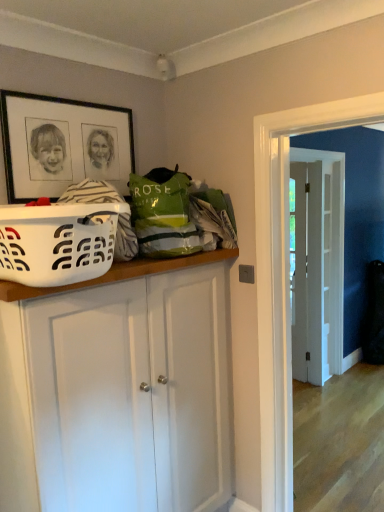
Question: Should I look upward or downward to see white plastic laundry basket at left?

Choices:
 (A) down
 (B) up

Answer: (B)

Question: Is white matte cabinet at center touching black matte picture frame at upper left?

Choices:
 (A) yes
 (B) no

Answer: (B)

Question: Considering the relative positions of white matte cabinet at center and black matte picture frame at upper left in the image provided, is white matte cabinet at center in front of black matte picture frame at upper left?

Choices:
 (A) yes
 (B) no

Answer: (A)

Question: Does white matte cabinet at center appear on the left side of black matte picture frame at upper left?

Choices:
 (A) no
 (B) yes

Answer: (A)

Question: Is white matte cabinet at center outside of black matte picture frame at upper left?

Choices:
 (A) no
 (B) yes

Answer: (B)

Question: Is white matte cabinet at center facing away from black matte picture frame at upper left?

Choices:
 (A) no
 (B) yes

Answer: (A)

Question: Does white matte cabinet at center turn towards black matte picture frame at upper left?

Choices:
 (A) yes
 (B) no

Answer: (B)

Question: Considering the relative sizes of white matte cabinet at center and white wooden door at center in the image provided, is white matte cabinet at center wider than white wooden door at center?

Choices:
 (A) no
 (B) yes

Answer: (A)

Question: Can you confirm if white matte cabinet at center is thinner than white wooden door at center?

Choices:
 (A) no
 (B) yes

Answer: (B)

Question: Is white matte cabinet at center closer to the viewer compared to white wooden door at center?

Choices:
 (A) no
 (B) yes

Answer: (B)

Question: Is there a large distance between white matte cabinet at center and white wooden door at center?

Choices:
 (A) no
 (B) yes

Answer: (B)

Question: From the image's perspective, is white matte cabinet at center over white wooden door at center?

Choices:
 (A) yes
 (B) no

Answer: (B)

Question: Does white matte cabinet at center have a larger size compared to white wooden door at center?

Choices:
 (A) no
 (B) yes

Answer: (A)

Question: Is white wooden door at center positioned before white matte cabinet at center?

Choices:
 (A) no
 (B) yes

Answer: (A)